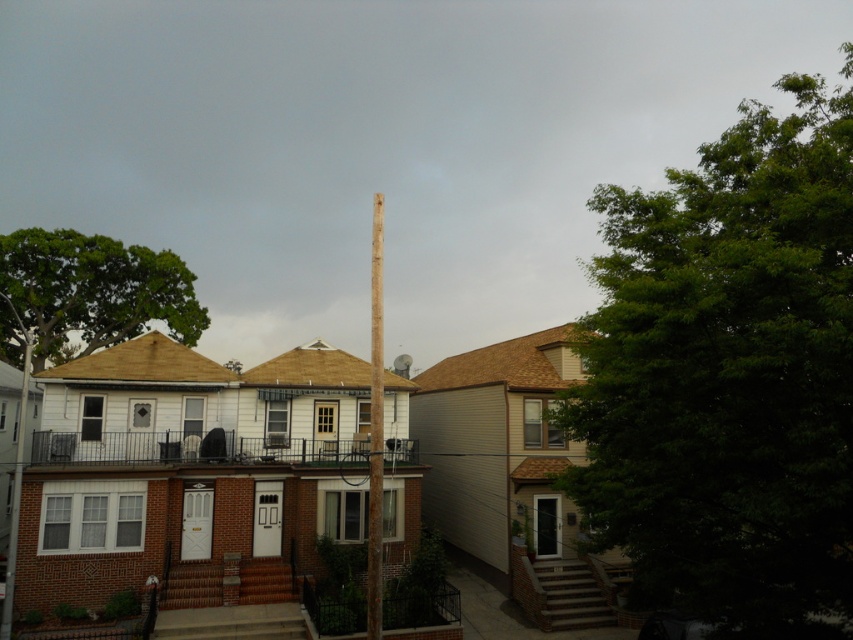
You are standing in front of the two houses and want to plant a new tree. The city requires that any new tree must be placed at least 3 meters away from the nearest utility pole. Given that the utility pole is in the foreground, can you determine if the green leafy tree at right meets this requirement based on its current position?

The green leafy tree at right is located at point (729, 376) in 2D coordinates. Since the utility pole is in the foreground, its position would be closer to the viewer compared to the tree. Without specific distance measurements, it is impossible to confirm if the tree meets the 3 meters requirement.

You are a delivery person trying to deliver a package to the house on the right. There is a smooth brown wooden pole at center and a brown wooden telegraph pole at left blocking your path. Can you pass through between them without moving the poles?

The smooth brown wooden pole at center has a smaller width than the brown wooden telegraph pole at left, so there might be enough space to pass through between them. However, since the exact distance between them isn